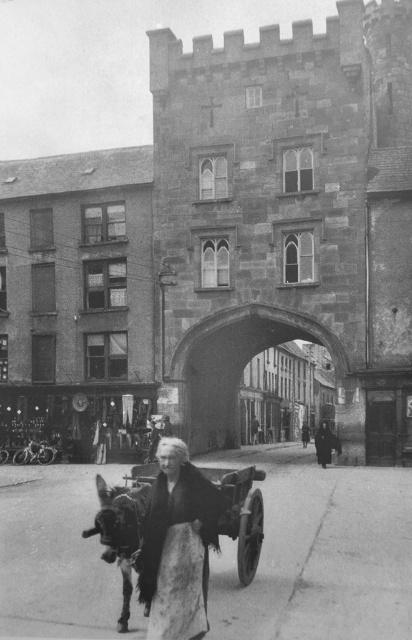
You are a photographer analyzing the composition of this historical image. You notice the dark brown fur coat at center and the wooden cart at lower center. Based on their positions, which object appears shorter in the scene?

The dark brown fur coat at center appears shorter than the wooden cart at lower center in the scene.

You are a photographer who wants to capture a closeup of both the dark brown fur coat at center and the wooden cart at lower center in the scene. Given their distance, can you fit both into your camera frame without moving your position? Your camera has a maximum field of view of 5 meters.

The dark brown fur coat at center is 6.15 meters away from the wooden cart at lower center. Since the camera can only capture up to 5 meters, you cannot fit both into the frame without moving your position.